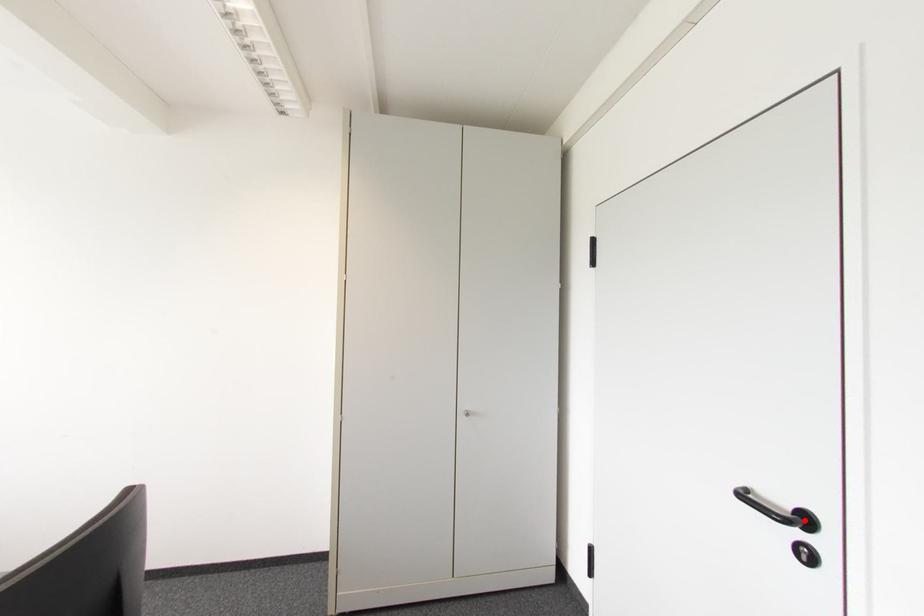
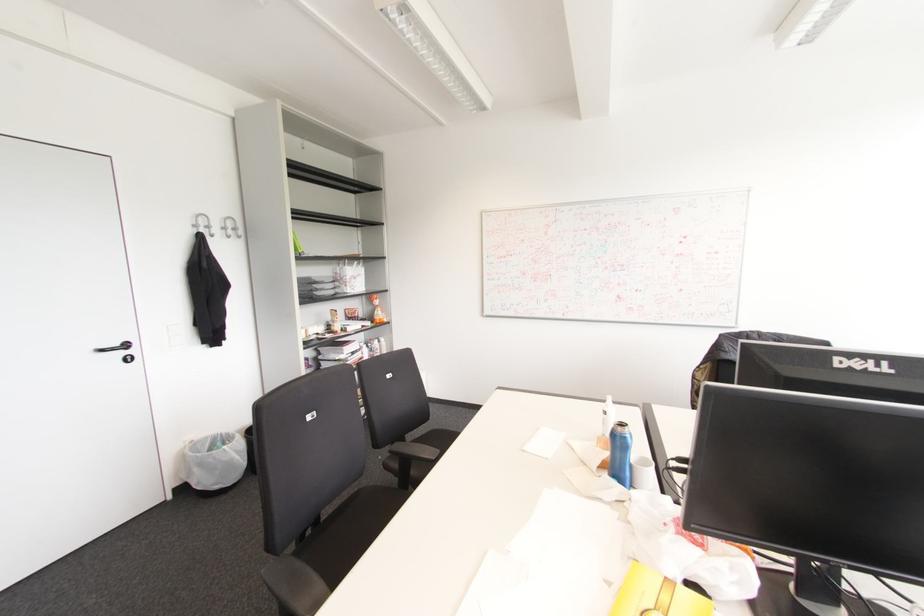
Where in the second image is the point corresponding to the highlighted location from the first image?

(126, 345)